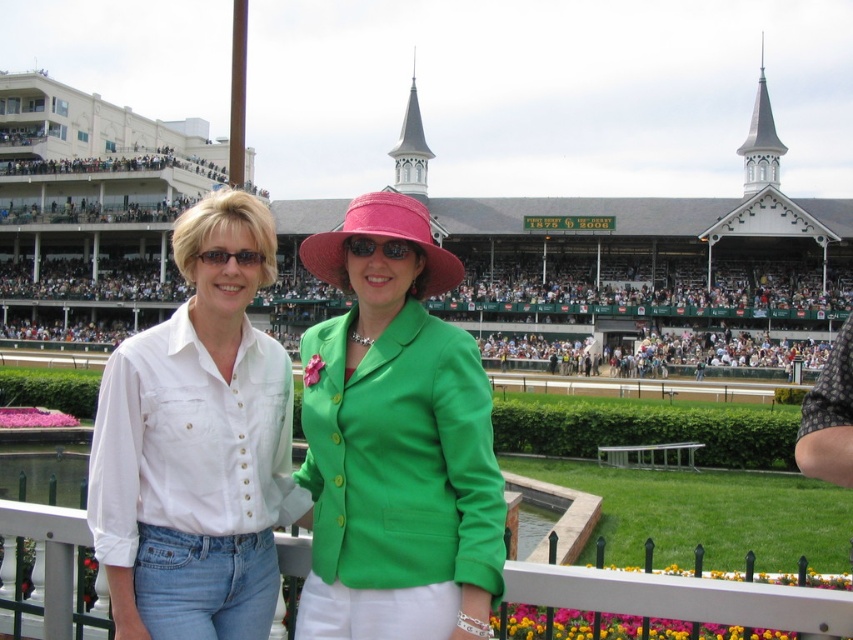
Question: Estimate the real-world distances between objects in this image. Which object is closer to the white plastic fence at center?

Choices:
 (A) white cotton shirt at center
 (B) pink matte hat at center
 (C) green matte blazer at center
 (D) matte black sunglasses at center

Answer: (C)

Question: Estimate the real-world distances between objects in this image. Which object is closer to the matte black sunglasses at center?

Choices:
 (A) white plastic fence at center
 (B) pink matte hat at center
 (C) green matte blazer at center
 (D) white cotton shirt at center

Answer: (D)

Question: Which of the following is the farthest from the observer?

Choices:
 (A) white plastic fence at center
 (B) white cotton shirt at center
 (C) green matte blazer at center
 (D) pink matte hat at center

Answer: (D)

Question: Is green matte blazer at center smaller than pink matte hat at center?

Choices:
 (A) no
 (B) yes

Answer: (A)

Question: Is pink matte hat at center below matte black sunglasses at center?

Choices:
 (A) yes
 (B) no

Answer: (B)

Question: Can you confirm if white plastic fence at center is positioned to the left of pink matte hat at center?

Choices:
 (A) no
 (B) yes

Answer: (A)